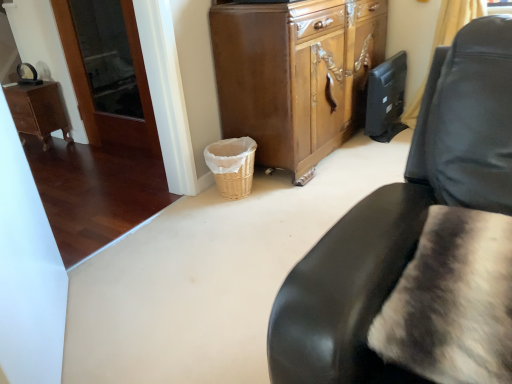
This screenshot has height=384, width=512. I want to click on free space in front of wooden cabinet at center, so click(x=293, y=200).